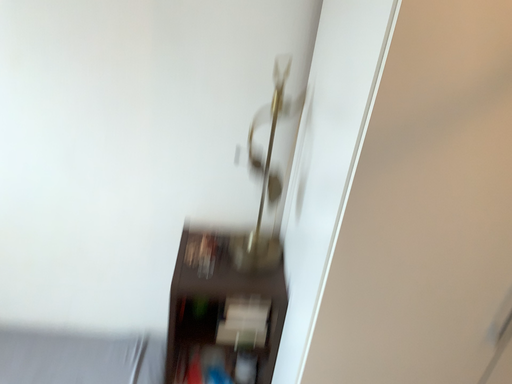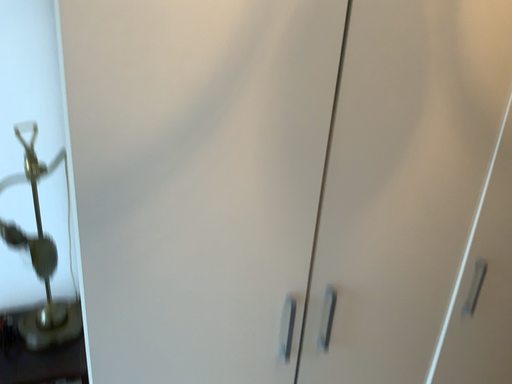
Question: How did the camera likely rotate when shooting the video?

Choices:
 (A) rotated right
 (B) rotated left

Answer: (A)